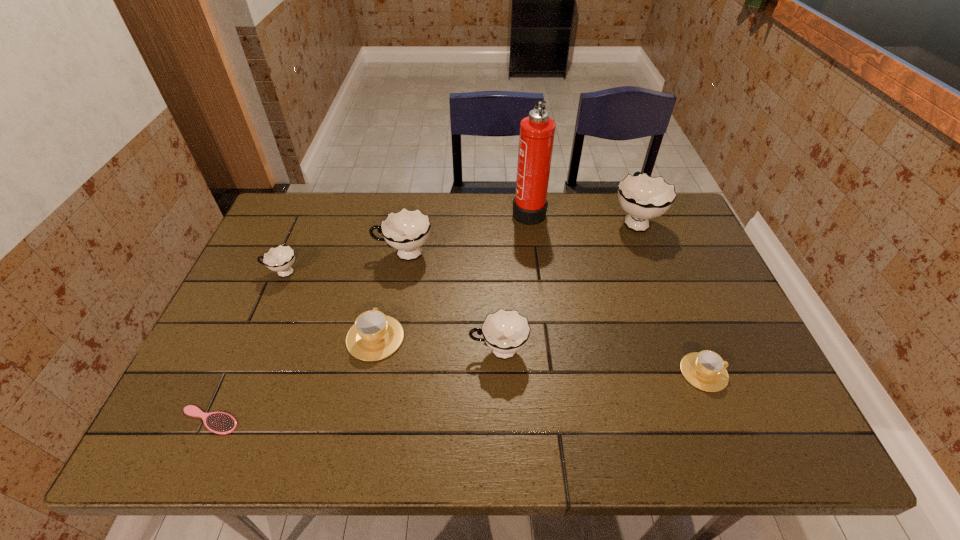
Where is `free space located 0.060m on the side of the sixth shortest object with the handle`? The image size is (960, 540). free space located 0.060m on the side of the sixth shortest object with the handle is located at coordinates (354, 254).

Where is `vacant area situated on the side of the second white cup from right to left with the handle`? vacant area situated on the side of the second white cup from right to left with the handle is located at coordinates (331, 350).

Where is `vacant space located 0.070m on the side of the second white cup from right to left with the handle`? This screenshot has width=960, height=540. vacant space located 0.070m on the side of the second white cup from right to left with the handle is located at coordinates (441, 350).

The height and width of the screenshot is (540, 960). Find the location of `vacant space located 0.110m on the side of the second white cup from right to left with the handle`. vacant space located 0.110m on the side of the second white cup from right to left with the handle is located at coordinates (424, 350).

Locate an element on the screen. free point located 0.340m with the handle on the side of the bigger brown cup is located at coordinates (396, 232).

Image resolution: width=960 pixels, height=540 pixels. I want to click on free region located 0.240m with the handle on the side of the bigger brown cup, so click(x=393, y=254).

Identify the location of free space located 0.160m with the handle on the side of the bigger brown cup. (389, 273).

I want to click on blank space located on the right of the shortest object, so click(x=326, y=420).

The width and height of the screenshot is (960, 540). What are the coordinates of `fire extinguisher that is positioned at the far edge` in the screenshot? It's located at (536, 138).

Identify the location of object present at the near edge. (222, 423).